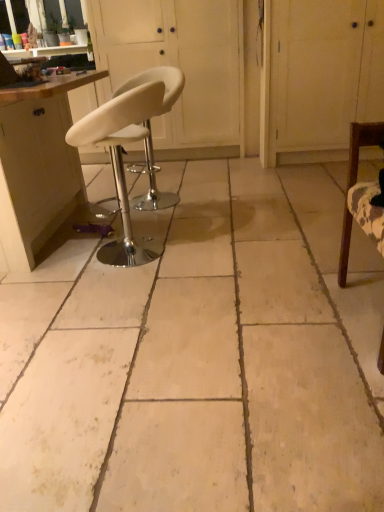
The width and height of the screenshot is (384, 512). In order to click on vacant space to the right of white leather stool at center, the third chair positioned from the front in this screenshot , I will do `click(217, 195)`.